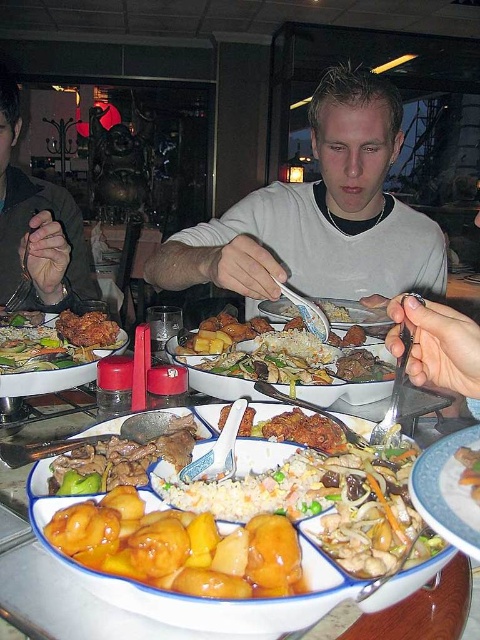
Question: Which of the following is the closest to the observer?

Choices:
 (A) (299, 372)
 (B) (478, 490)
 (C) (349, 304)
 (D) (242, 241)

Answer: (B)

Question: Which point is closer to the camera?

Choices:
 (A) shiny orange glazed chicken at center
 (B) matte black fork at left
 (C) golden fried chicken at center
 (D) white matte shirt at center

Answer: (A)

Question: Which object is closer to the camera taking this photo?

Choices:
 (A) glossy yellow fruit at center
 (B) white matte shirt at center

Answer: (A)

Question: Can you confirm if golden crispy chicken at center is smaller than shiny plastic fork at center?

Choices:
 (A) no
 (B) yes

Answer: (A)

Question: Is white matte shirt at center to the right of golden fried chicken at center from the viewer's perspective?

Choices:
 (A) no
 (B) yes

Answer: (B)

Question: Can you confirm if glossy yellow fruit at center is thinner than shiny silver spoon at center?

Choices:
 (A) yes
 (B) no

Answer: (B)